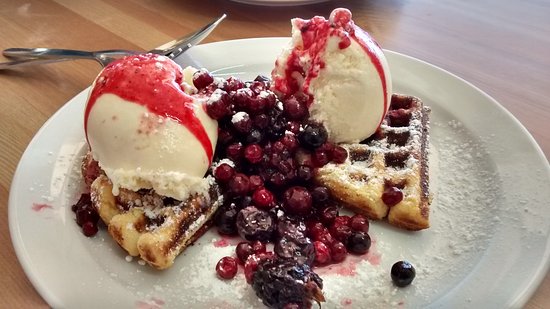
You are a GUI agent. You are given a task and a screenshot of the screen. Output one action in this format:
    pyautogui.click(x=<x>, y=<y>)
    Task: Click on the rim of plate
    
    Given the screenshot: What is the action you would take?
    pyautogui.click(x=513, y=117)